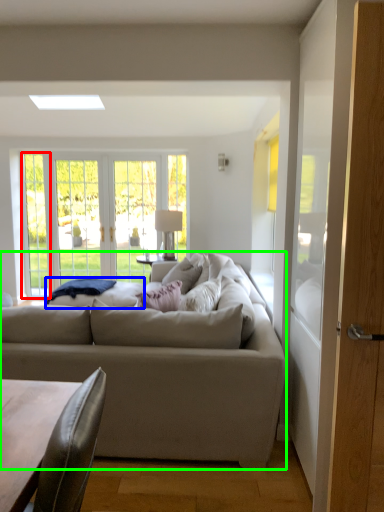
Question: Estimate the real-world distances between objects in this image. Which object is closer to window (highlighted by a red box), wide (highlighted by a blue box) or studio couch (highlighted by a green box)?

Choices:
 (A) wide
 (B) studio couch

Answer: (A)